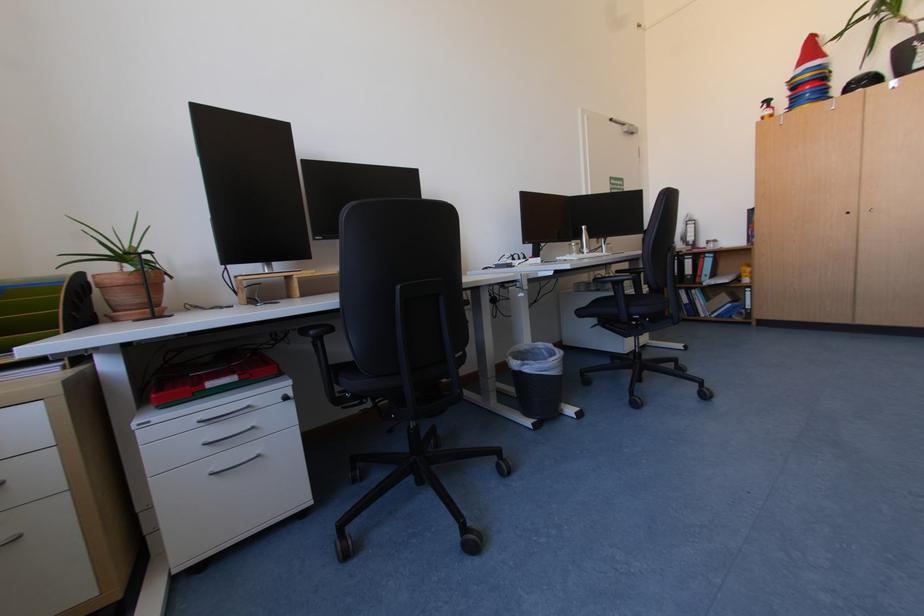
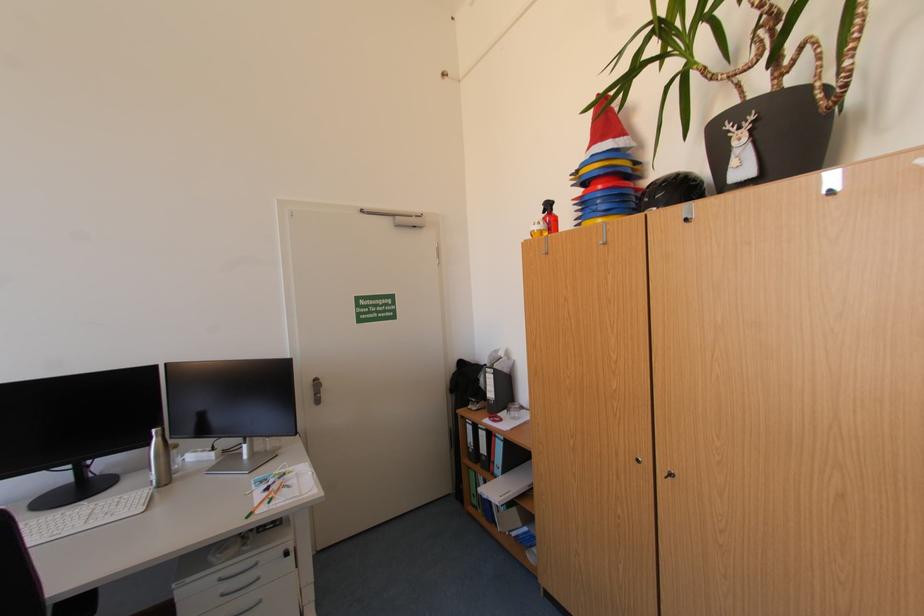
Locate, in the second image, the point that corresponds to point (591, 228) in the first image.

(161, 431)